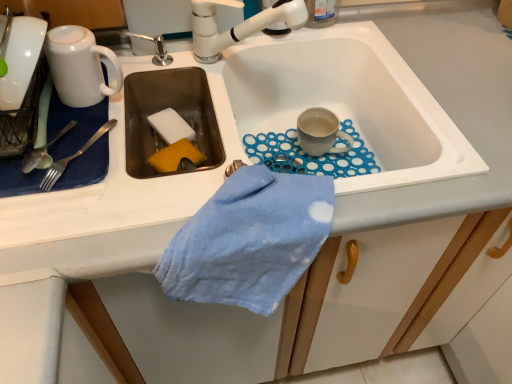
Where is `vacant space in front of satin silver spoon at left, arranged as the 2th silverware when viewed from the right`? vacant space in front of satin silver spoon at left, arranged as the 2th silverware when viewed from the right is located at coordinates (65, 230).